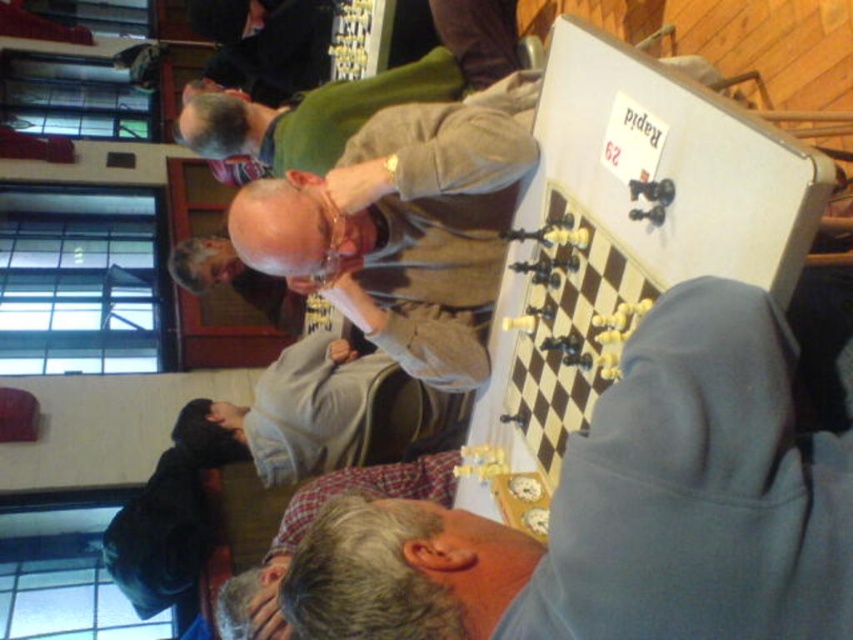
You are a photographer taking a picture of the chessboard. You notice two points marked on the chessboard at coordinates point [728,284] and point [314,337]. Which point will appear larger in your photo?

Point [728,284] is closer to the camera than point [314,337], so it will appear larger in the photo.

You are a photographer at the chess tournament and need to capture a clear shot of the chessboard. The gray hoodie at center and the light brown fabric shirt at center are blocking the view. Which clothing item should you ask to move first to ensure the chessboard is fully visible?

The gray hoodie at center is thinner than the light brown fabric shirt at center, so you should ask the person wearing the gray hoodie at center to move first since it takes up less space and can be moved more easily without obstructing the view further.

You are a photographer standing at the edge of the chess tournament venue. You want to take a photo that includes both the gray hoodie at center and the light brown fabric shirt at center. What is the minimum distance you should position your camera from the two objects to ensure they are both in frame?

The gray hoodie at center is 3.38 feet from the light brown fabric shirt at center. To capture both in the same frame, the camera should be positioned at least 3.38 feet away from the closer object so that the distance between them does not exceed the camera frame.